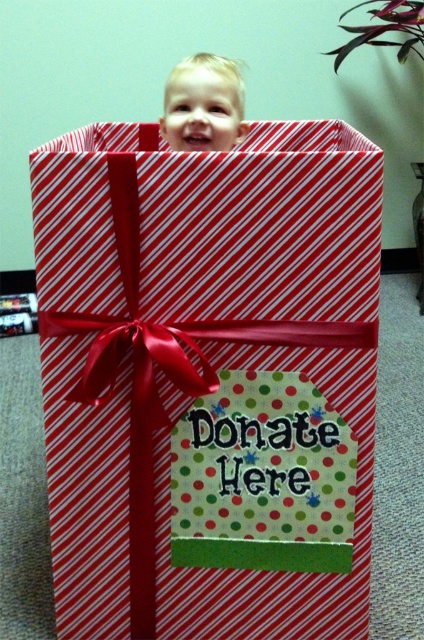
Which of these two, red striped gift box at center or blonde hair toddler at upper center, stands shorter?

With less height is blonde hair toddler at upper center.

Is point (257, 132) farther from camera compared to point (228, 134)?

Yes, point (257, 132) is behind point (228, 134).

Which is behind, point (287, 285) or point (226, 81)?

Point (226, 81)

You are a GUI agent. You are given a task and a screenshot of the screen. Output one action in this format:
    pyautogui.click(x=<x>, y=<y>)
    Task: Click on the red striped gift box at center
    This screenshot has height=640, width=424.
    Given the screenshot: What is the action you would take?
    pyautogui.click(x=209, y=380)